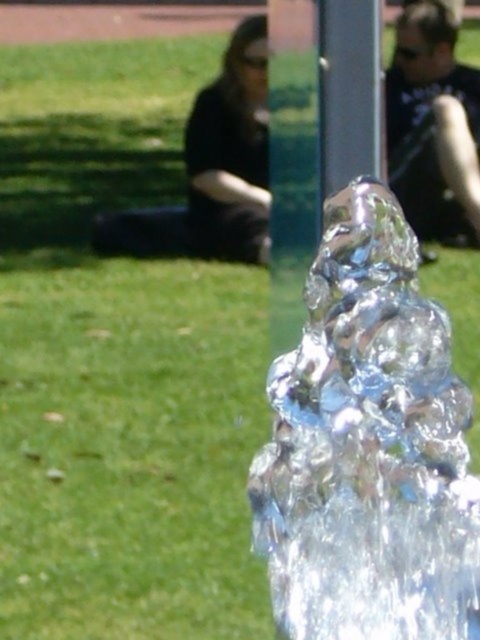
Question: Among these objects, which one is nearest to the camera?

Choices:
 (A) matte black shirt at upper right
 (B) clear glass water at center

Answer: (B)

Question: Is clear glass water at center bigger than matte black shirt at upper right?

Choices:
 (A) yes
 (B) no

Answer: (A)

Question: In this image, where is clear glass water at center located relative to matte black shirt at upper right?

Choices:
 (A) left
 (B) right

Answer: (A)

Question: Is the position of clear glass water at center more distant than that of matte black shirt at upper right?

Choices:
 (A) no
 (B) yes

Answer: (A)

Question: Which of the following is the farthest from the observer?

Choices:
 (A) (470, 109)
 (B) (314, 579)

Answer: (A)